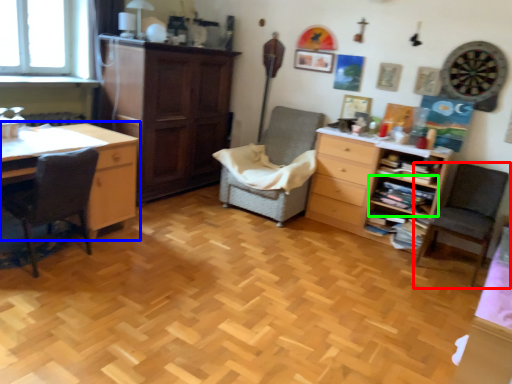
Question: Which is nearer to the chair (highlighted by a red box)? desk (highlighted by a blue box) or shelf (highlighted by a green box).

Choices:
 (A) desk
 (B) shelf

Answer: (B)